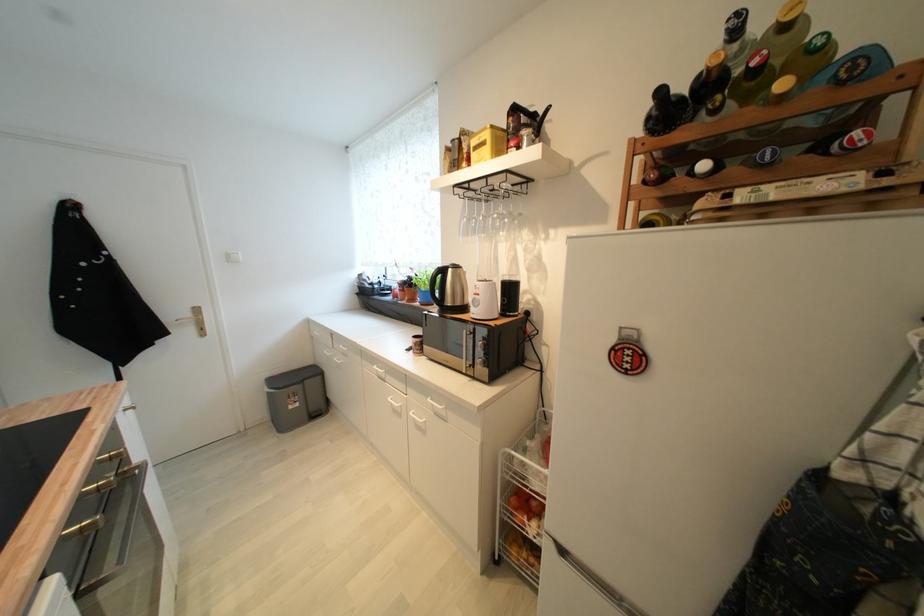
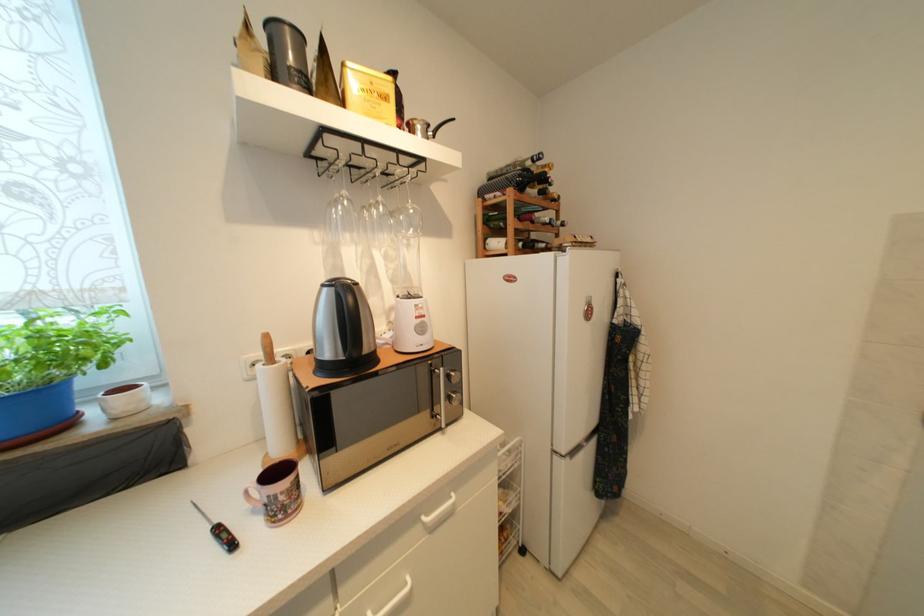
Find the pixel in the second image that matches (480,296) in the first image.

(421, 320)